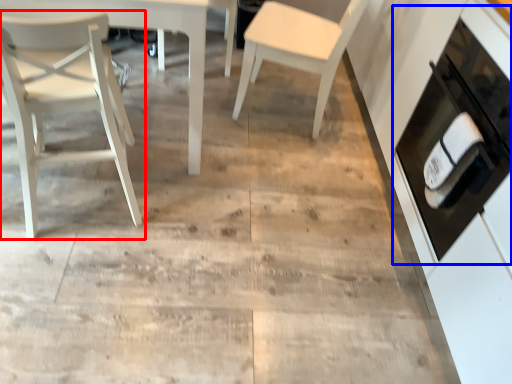
Question: Among these objects, which one is nearest to the camera, chair (highlighted by a red box) or cabinetry (highlighted by a blue box)?

Choices:
 (A) chair
 (B) cabinetry

Answer: (A)